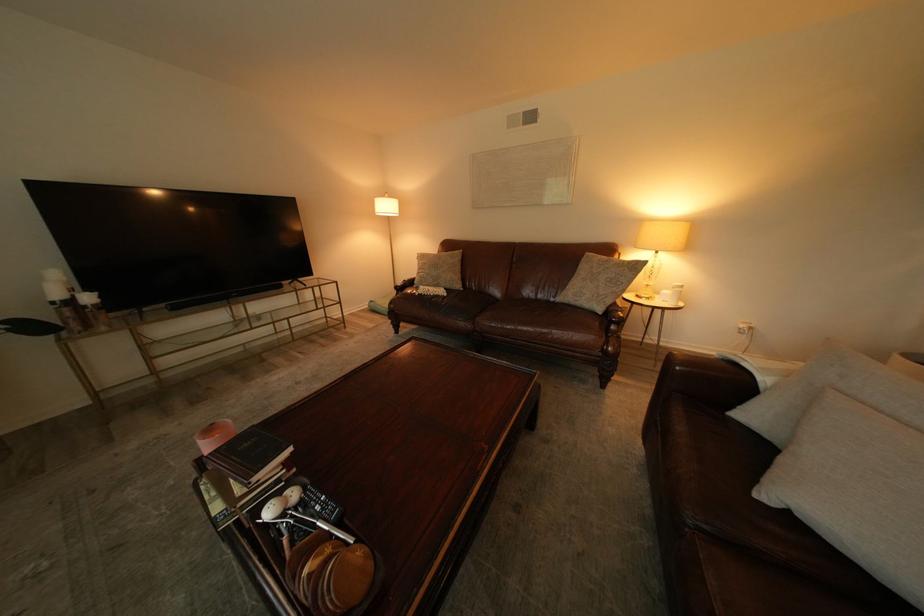
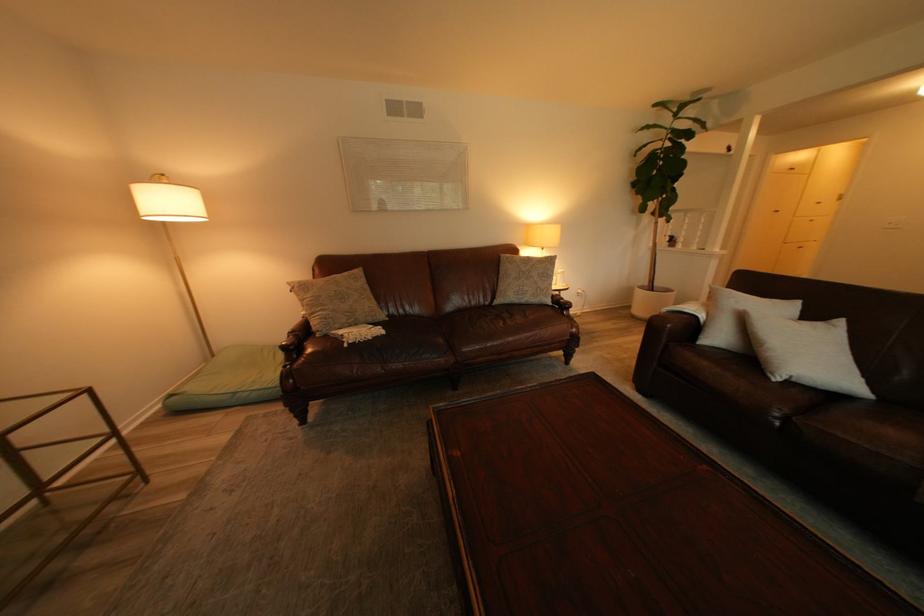
The point at (418, 282) is marked in the first image. Where is the corresponding point in the second image?

(304, 334)